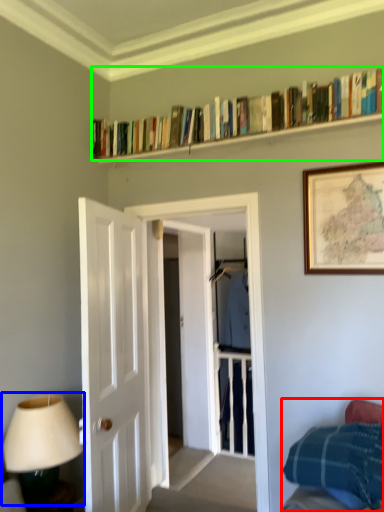
Question: Estimate the real-world distances between objects in this image. Which object is closer to bed (highlighted by a red box), table lamp (highlighted by a blue box) or book (highlighted by a green box)?

Choices:
 (A) table lamp
 (B) book

Answer: (A)